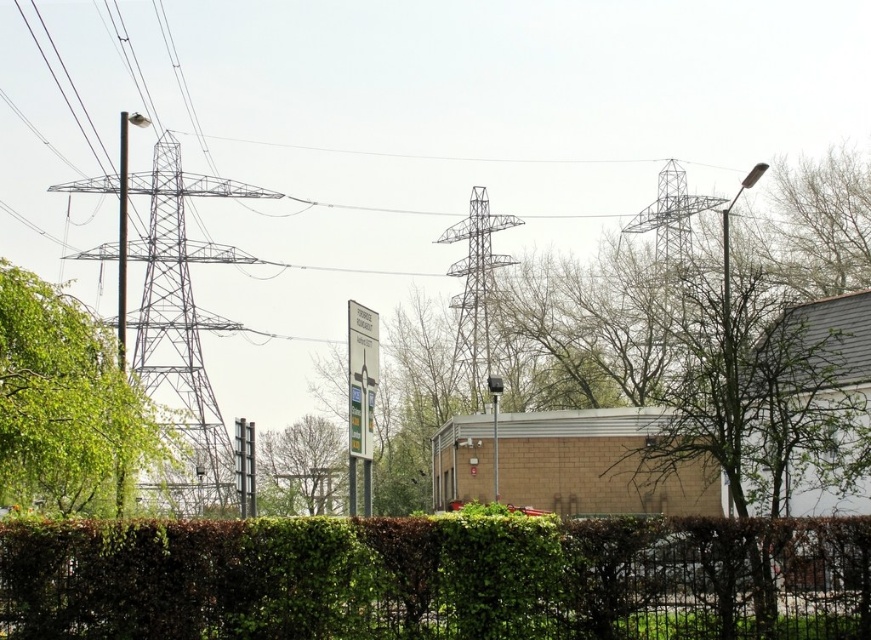
Question: Which of these objects is positioned farthest from the green leafy tree at left?

Choices:
 (A) green leafy hedge at lower center
 (B) bare branches at right

Answer: (B)

Question: Can you confirm if bare branches at right is smaller than green leafy tree at center?

Choices:
 (A) no
 (B) yes

Answer: (A)

Question: Does green leafy hedge at lower center have a larger size compared to green leafy tree at center?

Choices:
 (A) yes
 (B) no

Answer: (B)

Question: Which point appears farthest from the camera in this image?

Choices:
 (A) (780, 417)
 (B) (37, 444)
 (C) (496, 458)
 (D) (117, 509)

Answer: (C)

Question: Which point is farther to the camera?

Choices:
 (A) (120, 116)
 (B) (726, 429)

Answer: (A)

Question: Does metallic pole at left come in front of white plastic sign at center?

Choices:
 (A) no
 (B) yes

Answer: (B)